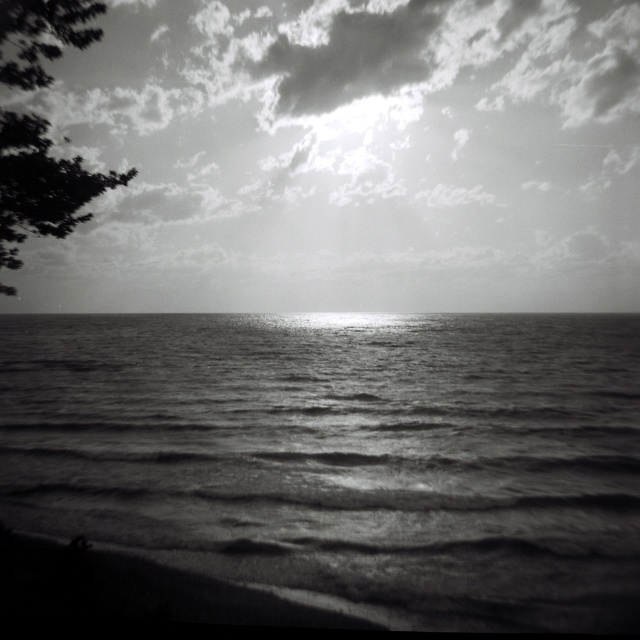
You are a photographer analyzing the composition of this coastal scene. Based on the image, which object occupies a wider area in the frame between the cloudy sky at upper center and the smooth water at center?

The cloudy sky at upper center is wider than the smooth water at center.